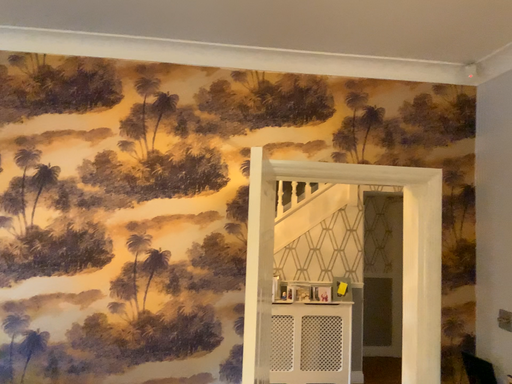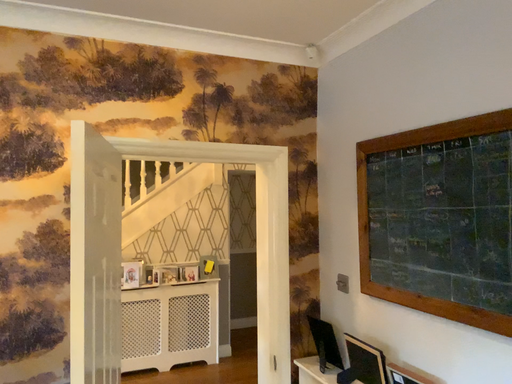
Question: Which way did the camera rotate in the video?

Choices:
 (A) rotated right
 (B) rotated left

Answer: (A)